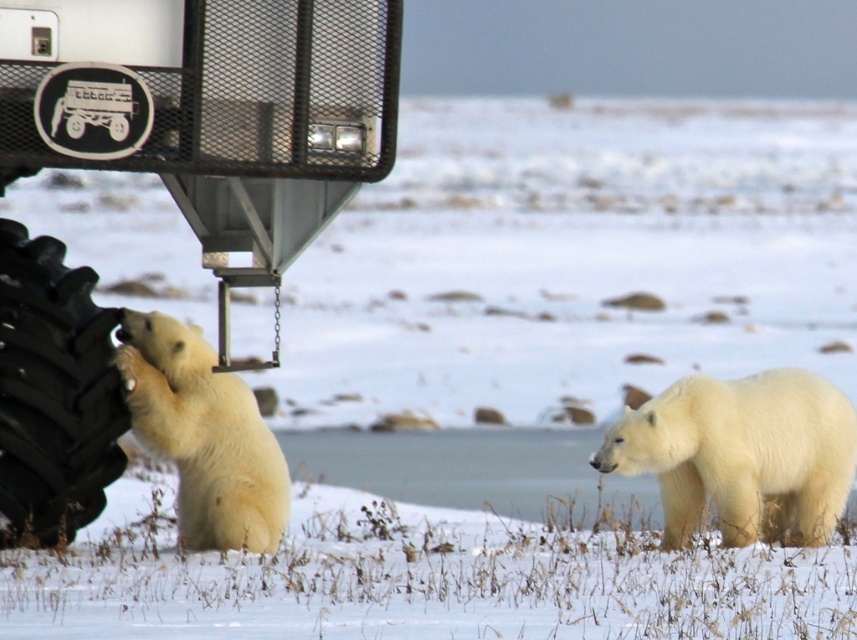
Can you confirm if white fluffy polar bear at right is smaller than white fur polar bear at center?

Incorrect, white fluffy polar bear at right is not smaller in size than white fur polar bear at center.

Is white fluffy polar bear at right to the left of white fur polar bear at center from the viewer's perspective?

Incorrect, white fluffy polar bear at right is not on the left side of white fur polar bear at center.

Does point (670, 532) come behind point (154, 364)?

Yes, it is behind point (154, 364).

Locate an element on the screen. The height and width of the screenshot is (640, 857). white fluffy polar bear at right is located at coordinates [x=742, y=454].

At what (x,y) coordinates should I click in order to perform the action: click on black rubber tire at lower left. Please return your answer as a coordinate pair (x, y). Image resolution: width=857 pixels, height=640 pixels. Looking at the image, I should click on (52, 394).

Which of these two, black rubber tire at lower left or brushed metal monster truck at left, stands shorter?

brushed metal monster truck at left

I want to click on black rubber tire at lower left, so click(x=52, y=394).

Locate an element on the screen. black rubber tire at lower left is located at coordinates (52, 394).

Is point (788, 422) farther from camera compared to point (106, 88)?

That is True.

Who is positioned more to the left, white fluffy polar bear at right or brushed metal monster truck at left?

From the viewer's perspective, brushed metal monster truck at left appears more on the left side.

What are the coordinates of `white fluffy polar bear at right` in the screenshot? It's located at (742, 454).

The image size is (857, 640). I want to click on white fluffy polar bear at right, so click(x=742, y=454).